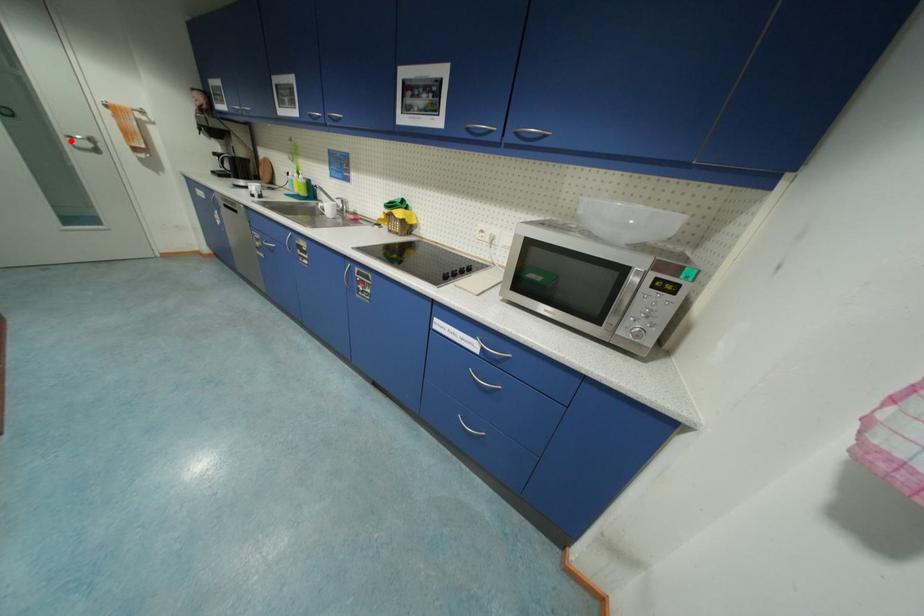
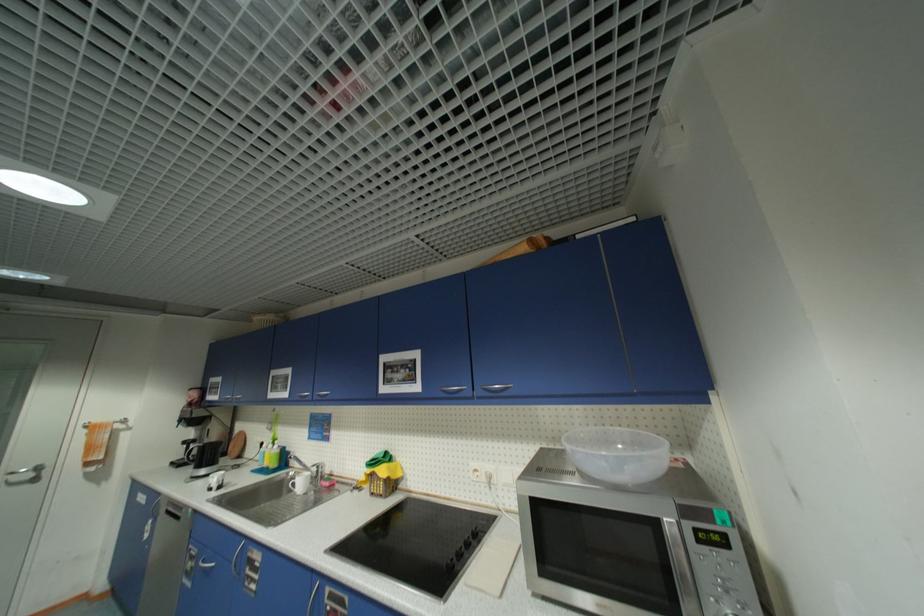
In the second image, find the point that corresponds to the highlighted location in the first image.

(7, 479)